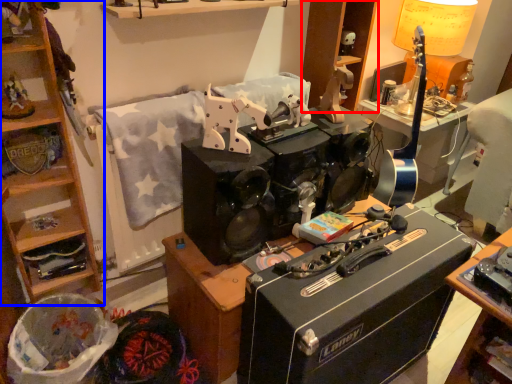
Question: Among these objects, which one is nearest to the camera, cabinetry (highlighted by a red box) or cabinetry (highlighted by a blue box)?

Choices:
 (A) cabinetry
 (B) cabinetry

Answer: (B)